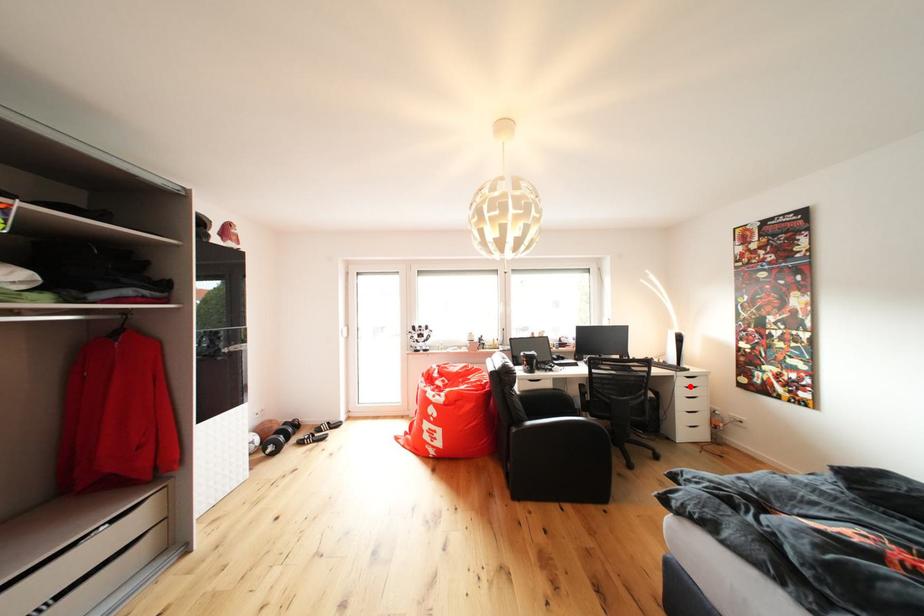
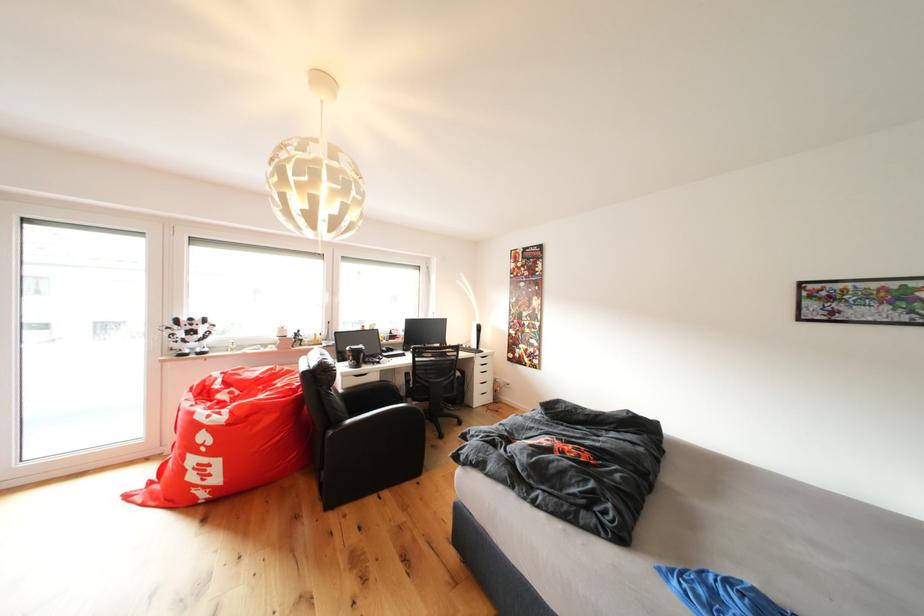
Question: I am providing you with two images of the same scene from different viewpoints. Given a red point in image1, look at the same physical point in image2. Is it:

Choices:
 (A) Closer to the viewpoint
 (B) Farther from the viewpoint

Answer: (B)